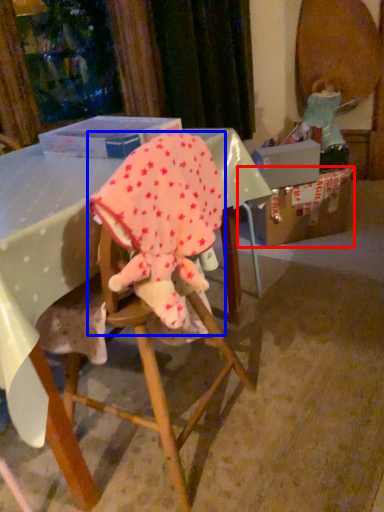
Question: Which object appears closest to the camera in this image, cardboard box (highlighted by a red box) or baby elephant (highlighted by a blue box)?

Choices:
 (A) cardboard box
 (B) baby elephant

Answer: (B)